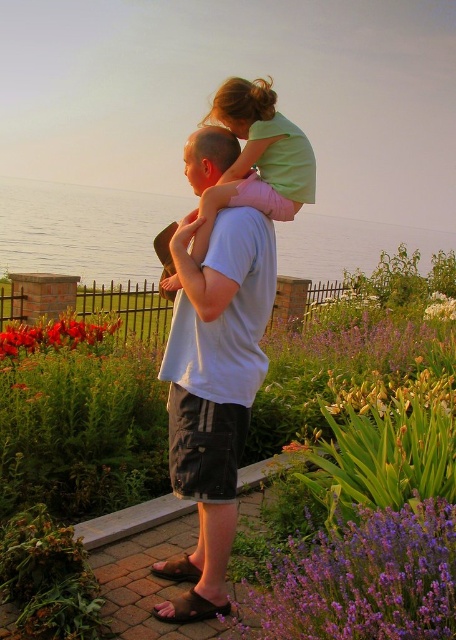
The width and height of the screenshot is (456, 640). What are the coordinates of `vivid red petals at lower left` in the screenshot? It's located at (56, 333).

Can you confirm if vivid red petals at lower left is thinner than white matte flower at upper right?

Incorrect, vivid red petals at lower left's width is not less than white matte flower at upper right's.

Who is more forward, (41,340) or (441,307)?

Point (41,340) is more forward.

Find the location of a particular element. The width and height of the screenshot is (456, 640). vivid red petals at lower left is located at coordinates (56, 333).

Is purple leafy plants at center below white matte flower at upper right?

Indeed, purple leafy plants at center is positioned under white matte flower at upper right.

Between point (86, 413) and point (449, 317), which one is positioned in front?

Point (86, 413)

Find the location of a particular element. purple leafy plants at center is located at coordinates (82, 429).

Consider the image. How distant is purple soft flower at lower right from vivid red petals at lower left?

purple soft flower at lower right and vivid red petals at lower left are 3.12 meters apart.

Between purple soft flower at lower right and vivid red petals at lower left, which one appears on the left side from the viewer's perspective?

Positioned to the left is vivid red petals at lower left.

Is point (372, 557) farther from camera compared to point (35, 340)?

That is False.

You are a GUI agent. You are given a task and a screenshot of the screen. Output one action in this format:
    pyautogui.click(x=<x>, y=<y>)
    Task: Click on the purple soft flower at lower right
    The height and width of the screenshot is (640, 456).
    Given the screenshot: What is the action you would take?
    pyautogui.click(x=361, y=580)